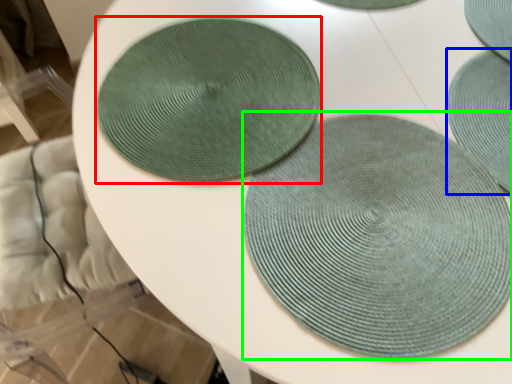
Question: Estimate the real-world distances between objects in this image. Which object is closer to coaster (highlighted by a red box), mat (highlighted by a blue box) or mat (highlighted by a green box)?

Choices:
 (A) mat
 (B) mat

Answer: (B)